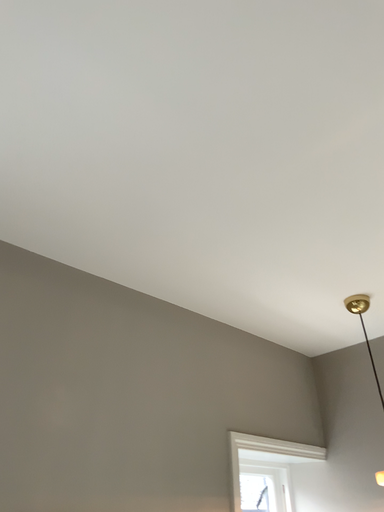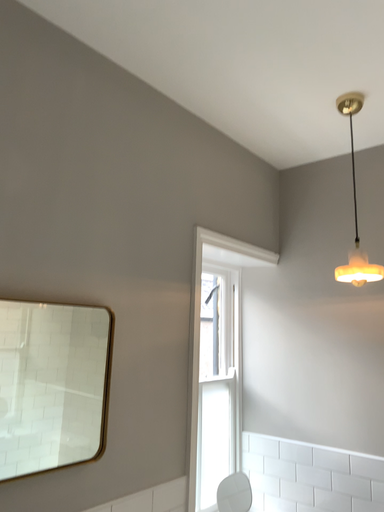
Question: How did the camera likely rotate when shooting the video?

Choices:
 (A) rotated upward
 (B) rotated downward

Answer: (B)